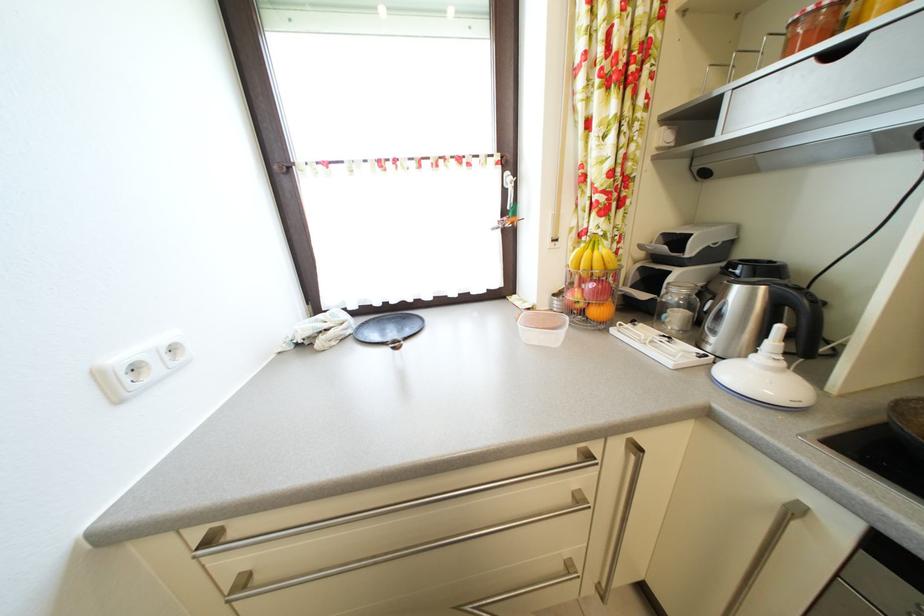
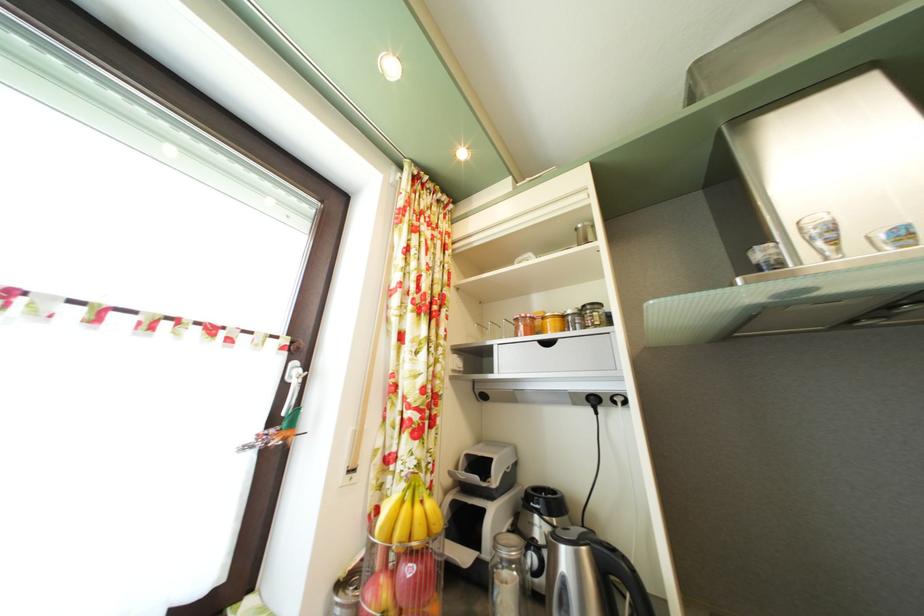
Find the pixel in the second image that matches the point at 803,30 in the first image.

(525, 326)